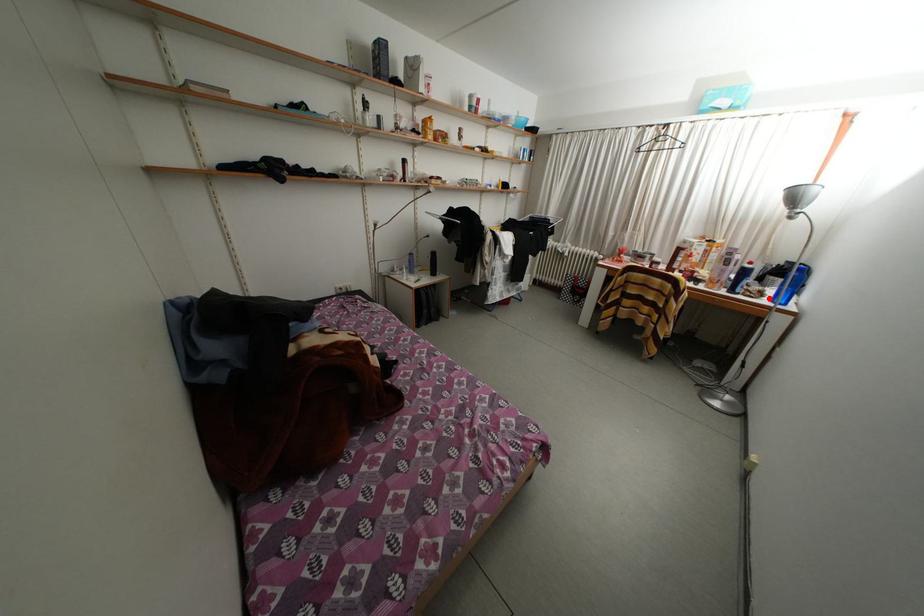
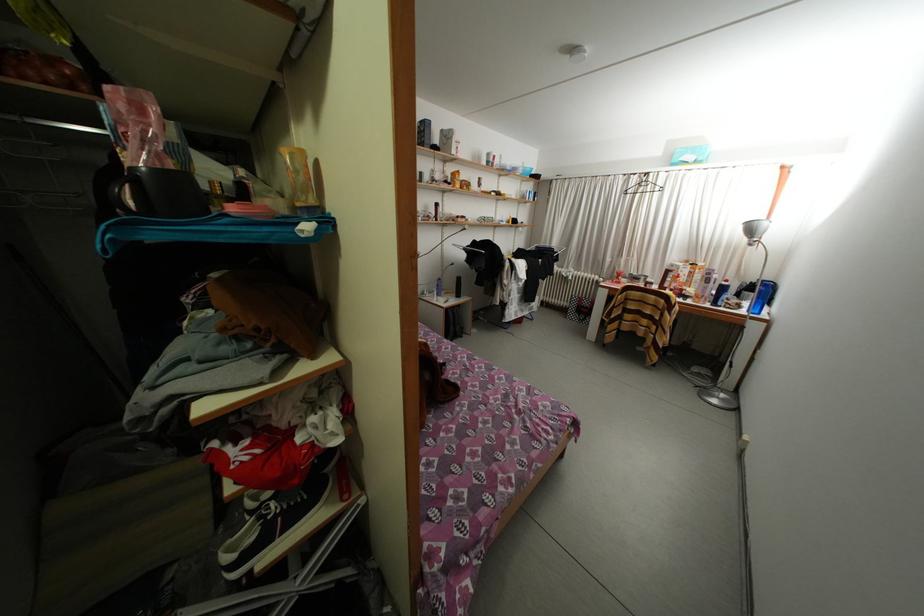
Question: I am providing you with two images of the same scene from different viewpoints. A red point is marked on the first image. At the location where the point appears in image 1, is it still visible in image 2?

Choices:
 (A) Yes
 (B) No

Answer: (A)